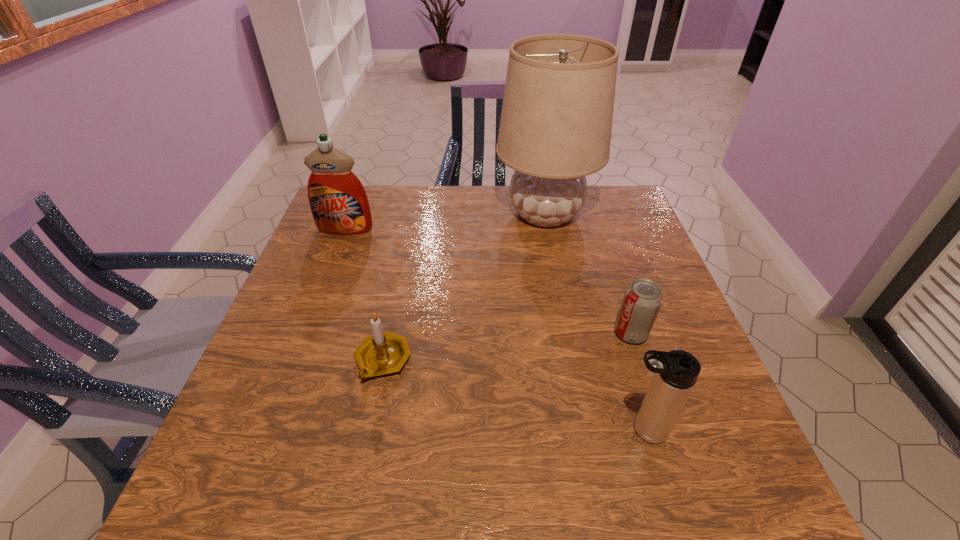
I want to click on free location that satisfies the following two spatial constraints: 1. on the front side of the tallest object; 2. on the right side of the soda can, so click(x=568, y=333).

Image resolution: width=960 pixels, height=540 pixels. Identify the location of free location that satisfies the following two spatial constraints: 1. on the front surface of the candle holder; 2. on the right side of the detergent. (295, 361).

The image size is (960, 540). I want to click on vacant position in the image that satisfies the following two spatial constraints: 1. on the back side of the candle holder; 2. on the left side of the soda can, so click(x=388, y=333).

Locate an element on the screen. Image resolution: width=960 pixels, height=540 pixels. free space that satisfies the following two spatial constraints: 1. on the back side of the soda can; 2. on the right side of the candle holder is located at coordinates (388, 333).